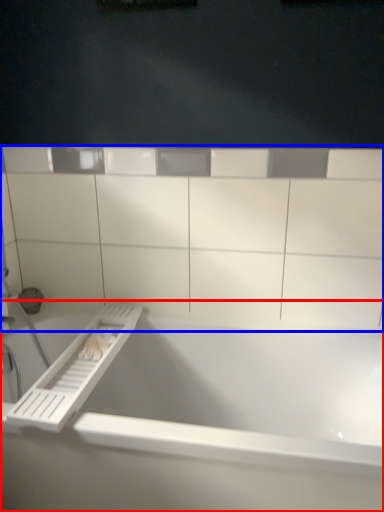
Question: Which of the following is the closest to the observer, bathtub (highlighted by a red box) or ledge (highlighted by a blue box)?

Choices:
 (A) bathtub
 (B) ledge

Answer: (A)